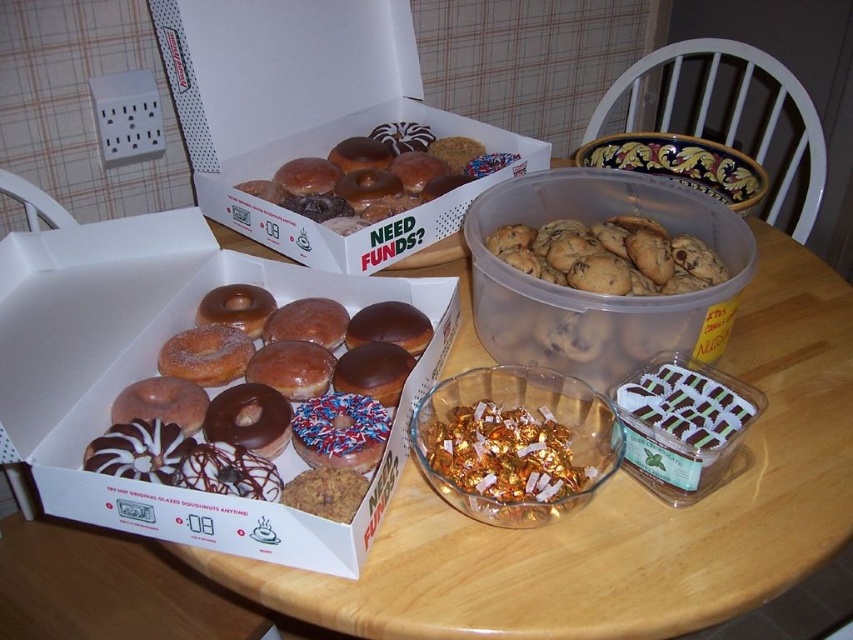
Can you confirm if white cardboard box of donuts at left is positioned to the left of glazed donuts at left?

Correct, you'll find white cardboard box of donuts at left to the left of glazed donuts at left.

Is white cardboard box of donuts at left behind glazed donuts at left?

No, it is not.

Where is `white cardboard box of donuts at left`? white cardboard box of donuts at left is located at coordinates (155, 372).

Locate an element on the screen. The width and height of the screenshot is (853, 640). white cardboard box of donuts at left is located at coordinates (155, 372).

Who is higher up, white cardboard box at upper center or glazed chocolate donut at center?

white cardboard box at upper center

Can you confirm if white cardboard box at upper center is positioned below glazed chocolate donut at center?

No.

Locate an element on the screen. This screenshot has width=853, height=640. white cardboard box at upper center is located at coordinates (308, 115).

You are a GUI agent. You are given a task and a screenshot of the screen. Output one action in this format:
    pyautogui.click(x=<x>, y=<y>)
    Task: Click on the white cardboard box at upper center
    This screenshot has width=853, height=640.
    Given the screenshot: What is the action you would take?
    pyautogui.click(x=308, y=115)

Does point (109, 384) come behind point (561, 488)?

Yes, point (109, 384) is farther from viewer.

Can you confirm if white cardboard box of donuts at left is positioned above gold foil wrapped chocolates at center?

Correct, white cardboard box of donuts at left is located above gold foil wrapped chocolates at center.

This screenshot has width=853, height=640. What are the coordinates of `white cardboard box of donuts at left` in the screenshot? It's located at (155, 372).